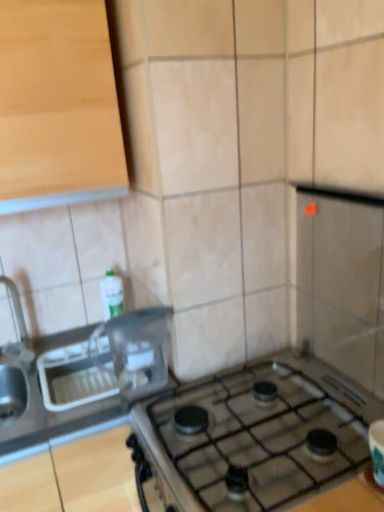
In order to face brushed metal faucet at left, should I rotate leftwards or rightwards?

Turn left by 23.217 degrees to look at brushed metal faucet at left.

In order to face light wood cabinet at upper left, should I rotate leftwards or rightwards?

You should look left and rotate roughly 18.470 degrees.

I want to click on satin silver sink at left, so click(57, 388).

Does brushed metal faucet at left turn towards satin silver sink at left?

No.

How different are the orientations of brushed metal faucet at left and satin silver sink at left in degrees?

0.000428 degrees.

From a real-world perspective, is brushed metal faucet at left physically located above or below satin silver sink at left?

In terms of real-world spatial position, brushed metal faucet at left is above satin silver sink at left.

Can you see light wood cabinet at upper left touching satin silver sink at left?

No.

Does light wood cabinet at upper left appear on the left side of satin silver sink at left?

Correct, you'll find light wood cabinet at upper left to the left of satin silver sink at left.

Is light wood cabinet at upper left wider than clear plastic container at center?

Indeed, light wood cabinet at upper left has a greater width compared to clear plastic container at center.

Is light wood cabinet at upper left to the left of clear plastic container at center from the viewer's perspective?

Yes.

You are a GUI agent. You are given a task and a screenshot of the screen. Output one action in this format:
    pyautogui.click(x=<x>, y=<y>)
    Task: Click on the cabinetry lying above the clear plastic container at center (from the image's perspective)
    This screenshot has height=512, width=384.
    Given the screenshot: What is the action you would take?
    pyautogui.click(x=58, y=106)

Is clear plastic container at center located within light wood cabinet at upper left?

No, light wood cabinet at upper left does not contain clear plastic container at center.

Is satin silver sink at left outside of clear plastic container at center?

Yes.

Considering the relative sizes of satin silver sink at left and clear plastic container at center in the image provided, is satin silver sink at left wider than clear plastic container at center?

Indeed, satin silver sink at left has a greater width compared to clear plastic container at center.

In the scene shown: Based on their positions, is satin silver sink at left located to the left or right of clear plastic container at center?

Based on their positions, satin silver sink at left is located to the left of clear plastic container at center.

In the scene shown: Considering the sizes of objects satin silver sink at left and clear plastic container at center in the image provided, who is shorter, satin silver sink at left or clear plastic container at center?

Standing shorter between the two is satin silver sink at left.

Is clear plastic container at center situated inside light wood cabinet at upper left or outside?

clear plastic container at center lies outside light wood cabinet at upper left.

Which object is thinner, clear plastic container at center or light wood cabinet at upper left?

With smaller width is clear plastic container at center.

In the scene shown: Between clear plastic container at center and light wood cabinet at upper left, which one has less height?

With less height is clear plastic container at center.

Where is `appliance located behind the light wood cabinet at upper left`? Image resolution: width=384 pixels, height=512 pixels. appliance located behind the light wood cabinet at upper left is located at coordinates (135, 350).

From the image's perspective, would you say brushed metal faucet at left is shown under light wood cabinet at upper left?

Indeed, from the image's perspective, brushed metal faucet at left is shown beneath light wood cabinet at upper left.

Does brushed metal faucet at left turn towards light wood cabinet at upper left?

No, brushed metal faucet at left is not oriented towards light wood cabinet at upper left.

Is brushed metal faucet at left smaller than light wood cabinet at upper left?

Yes.

Looking at their sizes, would you say brushed metal faucet at left is wider or thinner than light wood cabinet at upper left?

Clearly, brushed metal faucet at left has less width compared to light wood cabinet at upper left.

Between clear plastic container at center and brushed metal faucet at left, which one is positioned behind?

brushed metal faucet at left is more distant.

In the scene shown: Is clear plastic container at center shorter than brushed metal faucet at left?

Indeed, clear plastic container at center has a lesser height compared to brushed metal faucet at left.

Can you tell me how much clear plastic container at center and brushed metal faucet at left differ in facing direction?

The angle between the facing direction of clear plastic container at center and the facing direction of brushed metal faucet at left is 2.31 degrees.

The width and height of the screenshot is (384, 512). Identify the location of faucet on the left of the satin silver sink at left. (19, 330).

Locate an element on the screen. The height and width of the screenshot is (512, 384). cabinetry that appears above the satin silver sink at left (from the image's perspective) is located at coordinates (58, 106).

Based on their spatial positions, is brushed metal faucet at left or satin silver sink at left closer to clear plastic container at center?

The object closer to clear plastic container at center is satin silver sink at left.

Estimate the real-world distances between objects in this image. Which object is further from satin silver sink at left, clear plastic container at center or brushed metal faucet at left?

brushed metal faucet at left.

Looking at the image, which one is located closer to brushed metal faucet at left, light wood cabinet at upper left or clear plastic container at center?

clear plastic container at center is positioned closer to the anchor brushed metal faucet at left.

Considering their positions, is light wood cabinet at upper left positioned closer to satin silver sink at left than brushed metal faucet at left?

brushed metal faucet at left.

When comparing their distances from brushed metal faucet at left, does satin silver sink at left or light wood cabinet at upper left seem further?

light wood cabinet at upper left.

Considering their positions, is satin silver sink at left positioned further to clear plastic container at center than brushed metal faucet at left?

brushed metal faucet at left lies further to clear plastic container at center than the other object.

From the image, which object appears to be farther from brushed metal faucet at left, light wood cabinet at upper left or satin silver sink at left?

light wood cabinet at upper left is positioned further to the anchor brushed metal faucet at left.

Which object lies nearer to the anchor point light wood cabinet at upper left, brushed metal faucet at left or satin silver sink at left?

satin silver sink at left is positioned closer to the anchor light wood cabinet at upper left.

Identify the location of faucet between light wood cabinet at upper left and satin silver sink at left in the up-down direction. The height and width of the screenshot is (512, 384). (19, 330).

Find the location of a particular element. sink situated between brushed metal faucet at left and clear plastic container at center from left to right is located at coordinates (57, 388).

This screenshot has height=512, width=384. In order to click on appliance that lies between light wood cabinet at upper left and satin silver sink at left from top to bottom in this screenshot , I will do `click(135, 350)`.

Locate an element on the screen. faucet between light wood cabinet at upper left and clear plastic container at center in the up-down direction is located at coordinates (19, 330).